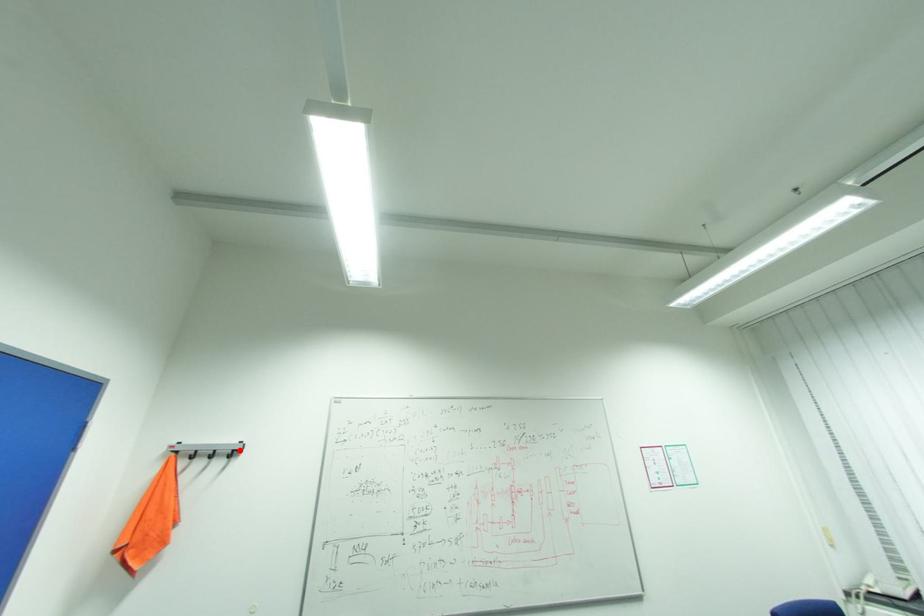
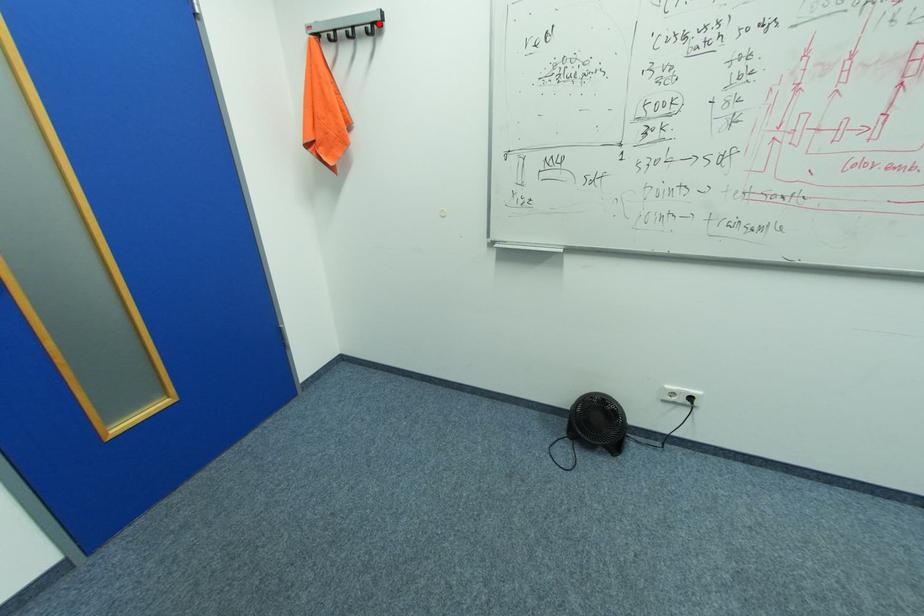
I am providing you with two images of the same scene from different viewpoints. A red point is marked on the first image and another point is marked on the second image. Do the highlighted points in image1 and image2 indicate the same real-world spot?

Yes